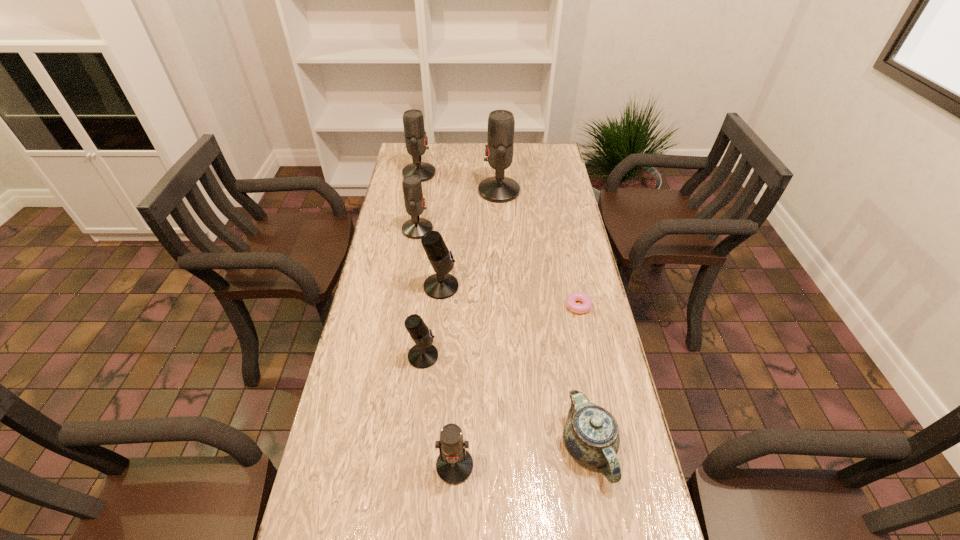
Image resolution: width=960 pixels, height=540 pixels. What are the coordinates of `free spot that satisfies the following two spatial constraints: 1. on the side of the rightmost red microphone with the red ring; 2. on the side of the second red microphone from right to left with the red ring` in the screenshot? It's located at (514, 465).

Where is `free spot that satisfies the following two spatial constraints: 1. on the side of the fourth nearest microphone with the red ring; 2. on the left side of the shortest object`? This screenshot has height=540, width=960. free spot that satisfies the following two spatial constraints: 1. on the side of the fourth nearest microphone with the red ring; 2. on the left side of the shortest object is located at coordinates (405, 306).

Image resolution: width=960 pixels, height=540 pixels. Identify the location of vacant region that satisfies the following two spatial constraints: 1. on the side of the shortest object with the red ring; 2. on the left side of the rightmost red microphone. (505, 306).

Locate an element on the screen. This screenshot has height=540, width=960. free space that satisfies the following two spatial constraints: 1. on the back side of the shortest object; 2. on the side of the fifth shortest microphone with the red ring is located at coordinates (548, 173).